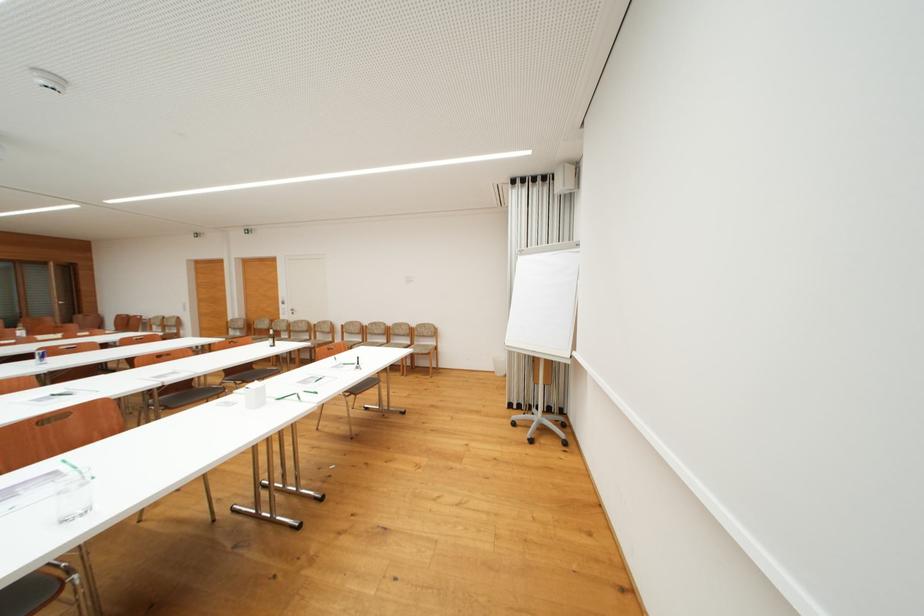
Find the location of a particular element. The height and width of the screenshot is (616, 924). green glass bottle is located at coordinates (x=272, y=338).